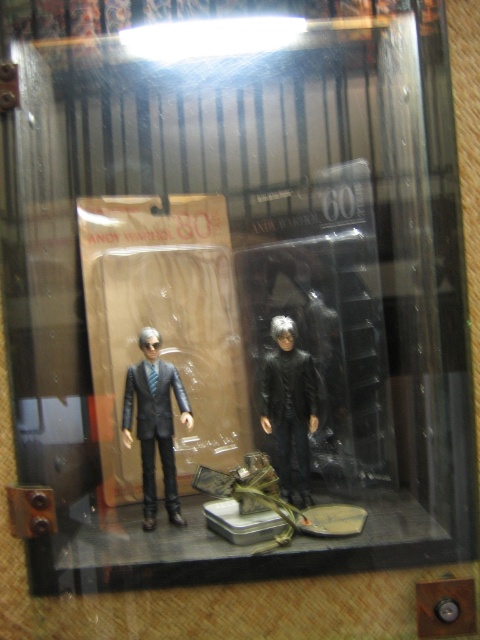
This screenshot has width=480, height=640. What do you see at coordinates (155, 422) in the screenshot?
I see `matte black suit at center` at bounding box center [155, 422].

Is matte black suit at center taller than black matte figure at center?

Yes, matte black suit at center is taller than black matte figure at center.

Who is more distant from viewer, (168, 484) or (277, 368)?

Positioned behind is point (277, 368).

Locate an element on the screen. matte black suit at center is located at coordinates (155, 422).